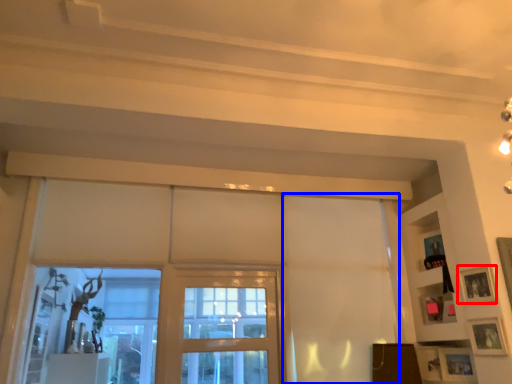
Question: Which point is closer to the camera, picture frame (highlighted by a red box) or curtain (highlighted by a blue box)?

Choices:
 (A) picture frame
 (B) curtain

Answer: (A)